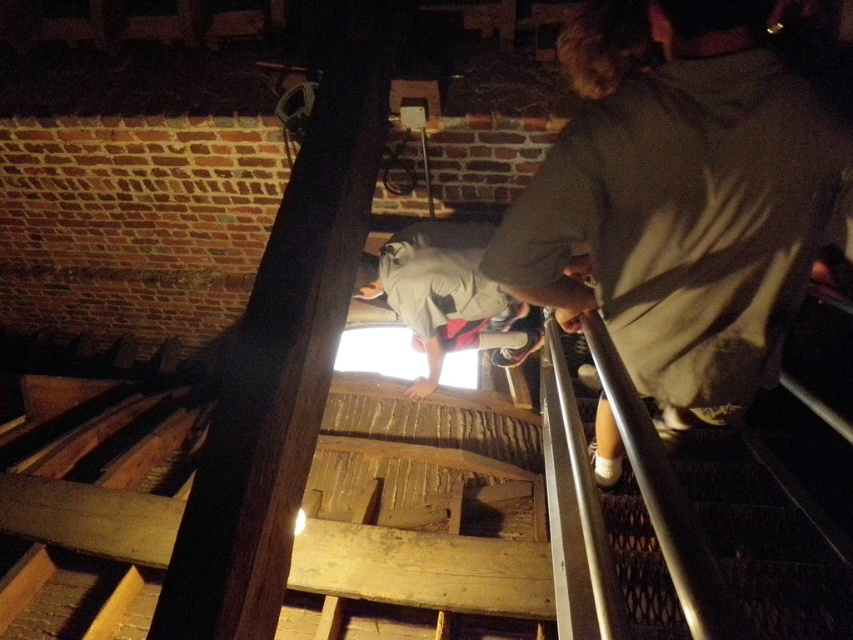
Question: Where is dark brown shirt at center located in relation to gray fabric shirt at center in the image?

Choices:
 (A) below
 (B) above

Answer: (B)

Question: Among these objects, which one is farthest from the camera?

Choices:
 (A) gray fabric shirt at center
 (B) dark wood beam at center

Answer: (A)

Question: Which point is farther to the camera?

Choices:
 (A) (624, 186)
 (B) (340, 40)

Answer: (B)

Question: From the image, what is the correct spatial relationship of dark brown shirt at center in relation to dark wood beam at center?

Choices:
 (A) above
 (B) below

Answer: (B)

Question: Considering the relative positions of dark wood beam at center and gray fabric shirt at center in the image provided, where is dark wood beam at center located with respect to gray fabric shirt at center?

Choices:
 (A) right
 (B) left

Answer: (B)

Question: Which object appears closest to the camera in this image?

Choices:
 (A) dark wood beam at center
 (B) gray fabric shirt at center

Answer: (A)